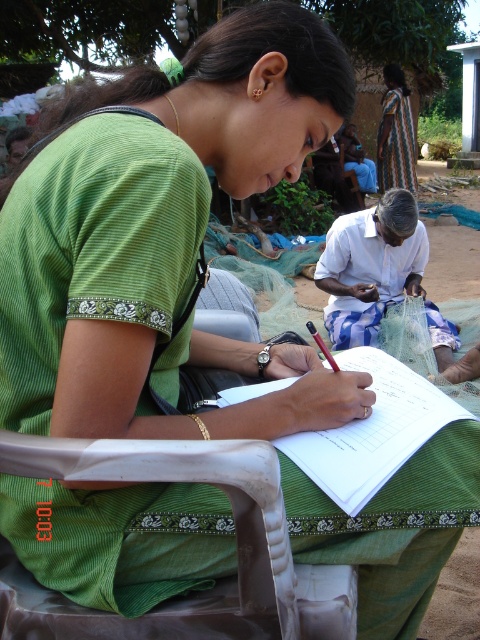
Question: Among these objects, which one is farthest from the camera?

Choices:
 (A) white paper at center
 (B) striped fabric dress at upper right

Answer: (B)

Question: Which point is closer to the camera taking this photo?

Choices:
 (A) (429, 387)
 (B) (412, 170)

Answer: (A)

Question: Does white paper at center appear over striped fabric dress at upper right?

Choices:
 (A) no
 (B) yes

Answer: (A)

Question: Does white paper at center lie in front of striped fabric dress at upper right?

Choices:
 (A) yes
 (B) no

Answer: (A)

Question: Does white paper at center appear over striped fabric dress at upper right?

Choices:
 (A) yes
 (B) no

Answer: (B)

Question: Which point is closer to the camera taking this photo?

Choices:
 (A) (391, 113)
 (B) (458, 412)

Answer: (B)